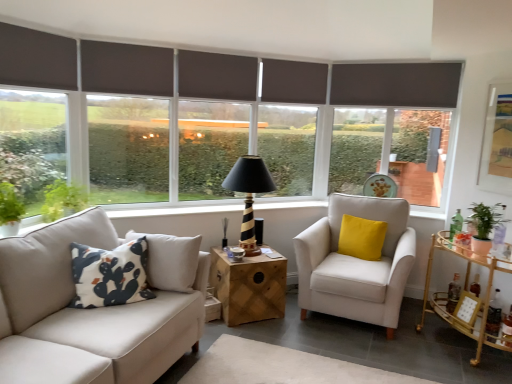
Question: In the image, is matte gray roller blind at center, acting as the first window starting from the right, on the left side or the right side of dark gray roller blind at center, positioned as the 3th window in left-to-right order?

Choices:
 (A) left
 (B) right

Answer: (B)

Question: Is matte gray roller blind at center, acting as the first window starting from the right, taller or shorter than dark gray roller blind at center, arranged as the second window when viewed from the right?

Choices:
 (A) tall
 (B) short

Answer: (B)

Question: Which object is the closest to the dark gray roller blind at left, the 2th window from the left?

Choices:
 (A) dark gray printed cushion at left, the 1th pillow positioned from the front
 (B) matte gray roller blind at center, the fourth window in the left-to-right sequence
 (C) green leafy plant at left
 (D) dark gray matte shutter at upper center, the 2th shutter positioned from the front
 (E) gold metallic bar cart at right, which is the first table from right to left

Answer: (D)

Question: Based on their relative distances, which object is nearer to the dark gray matte shutter at upper center, arranged as the fourth shutter when viewed from the left?

Choices:
 (A) black striped wood table lamp at center
 (B) brown fabric shutter at upper center, acting as the second shutter starting from the right
 (C) dark gray fabric at upper left, the 1th shutter viewed from the front
 (D) beige fabric armchair at center
 (E) dark gray matte shutter at upper center, the 3th shutter positioned from the right

Answer: (B)